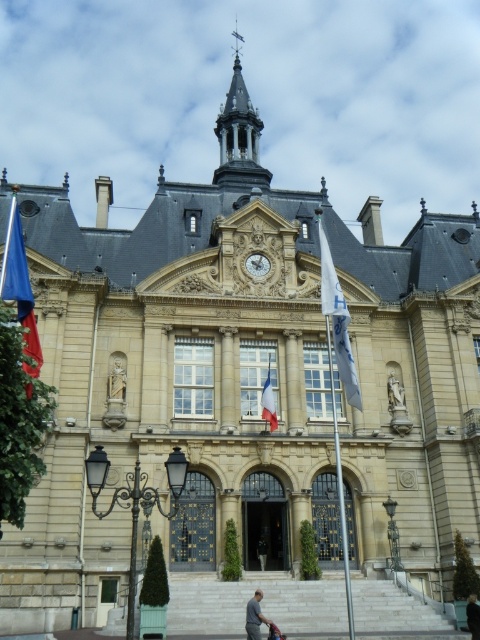
Question: Which object is the closest to the blue fabric flag at left?

Choices:
 (A) metallic silver baby carriage at lower center
 (B) gold metallic clock at center
 (C) dark blue fabric at center
 (D) gray fabric person at lower center

Answer: (B)

Question: Can you confirm if gray fabric person at lower center is bigger than gold metallic clock at center?

Choices:
 (A) yes
 (B) no

Answer: (A)

Question: Which point is closer to the camera taking this photo?

Choices:
 (A) (12, 221)
 (B) (471, 624)

Answer: (B)

Question: Observing the image, what is the correct spatial positioning of blue fabric flag at left in reference to dark blue fabric at center?

Choices:
 (A) left
 (B) right

Answer: (A)

Question: Which is farther from the metallic silver baby carriage at lower center?

Choices:
 (A) blue fabric flag at left
 (B) white marble statue at center

Answer: (A)

Question: Does french flag at center come behind gold metallic clock at center?

Choices:
 (A) yes
 (B) no

Answer: (B)